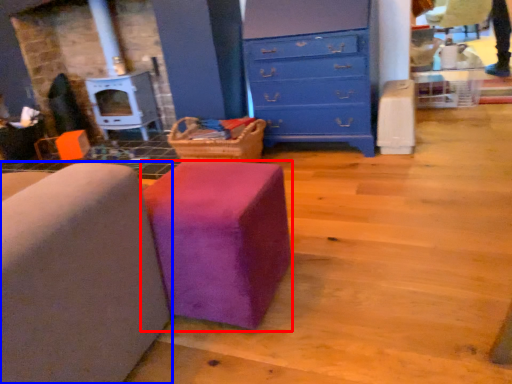
Question: Among these objects, which one is nearest to the camera, furniture (highlighted by a red box) or furniture (highlighted by a blue box)?

Choices:
 (A) furniture
 (B) furniture

Answer: (B)